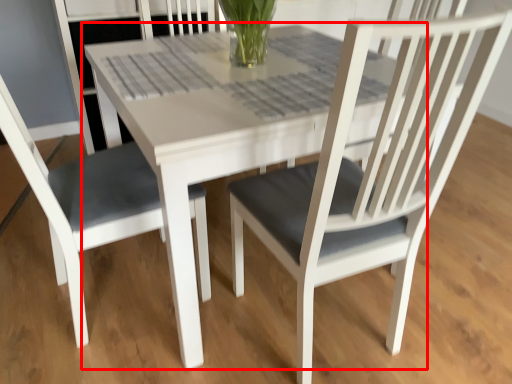
Question: Observing the image, what is the correct spatial positioning of round table (annotated by the red box) in reference to chair?

Choices:
 (A) left
 (B) right

Answer: (B)